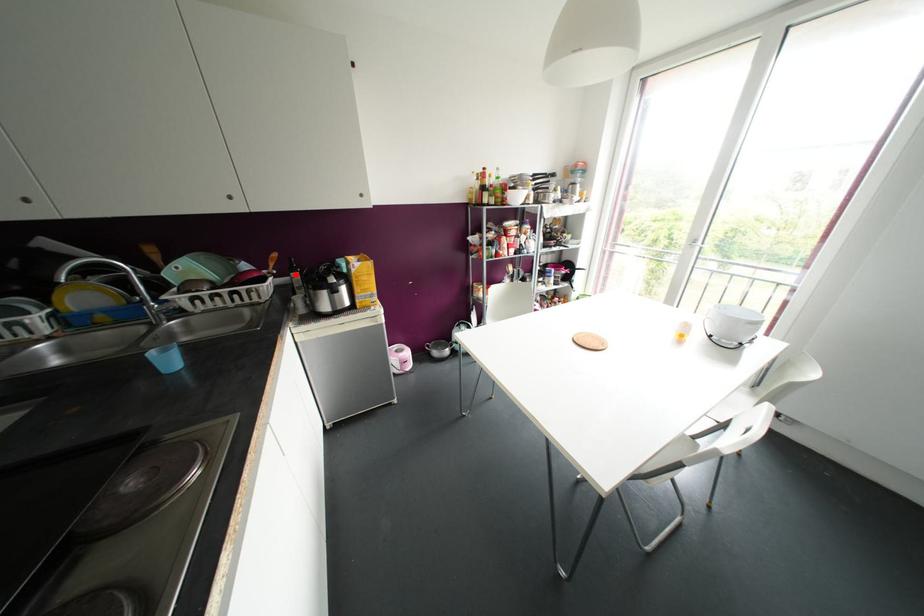
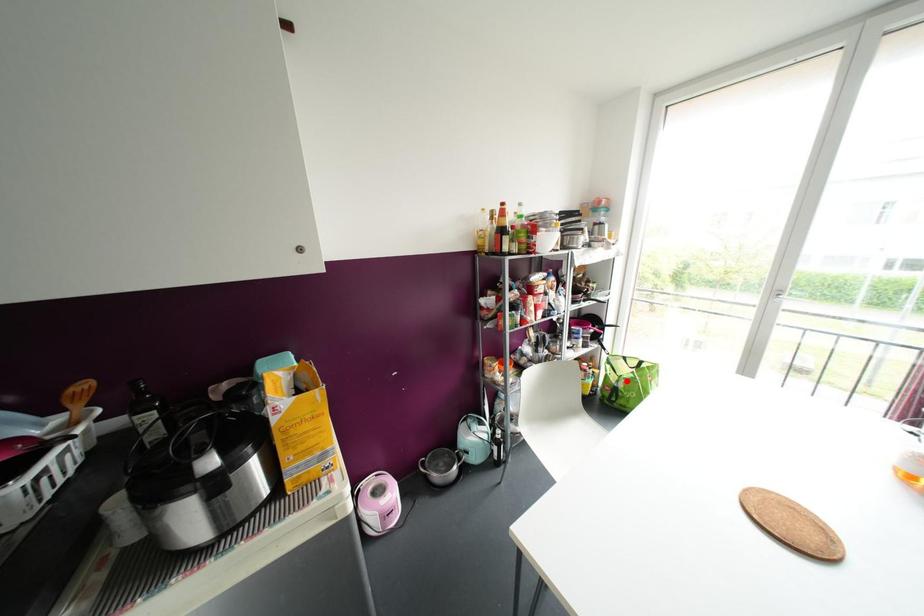
I am providing you with two images of the same scene from different viewpoints. A red point is marked on the first image and another point is marked on the second image. Is the red point in image1 aligned with the point shown in image2?

No